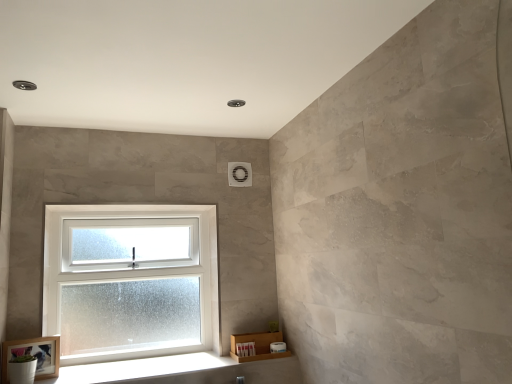
Question: From the image's perspective, is wooden frame at lower left on top of white wood at lower left?

Choices:
 (A) no
 (B) yes

Answer: (B)

Question: From the image's perspective, is wooden frame at lower left below white wood at lower left?

Choices:
 (A) yes
 (B) no

Answer: (B)

Question: Is wooden frame at lower left positioned with its back to white wood at lower left?

Choices:
 (A) yes
 (B) no

Answer: (B)

Question: Would you consider wooden frame at lower left to be distant from white wood at lower left?

Choices:
 (A) no
 (B) yes

Answer: (A)

Question: Is wooden frame at lower left to the right of white wood at lower left from the viewer's perspective?

Choices:
 (A) yes
 (B) no

Answer: (B)

Question: Is wooden frame at lower left shorter than white wood at lower left?

Choices:
 (A) no
 (B) yes

Answer: (A)

Question: Is wooden frame at lower left far away from white frosted glass window at lower left?

Choices:
 (A) no
 (B) yes

Answer: (A)

Question: Does wooden frame at lower left appear on the left side of white frosted glass window at lower left?

Choices:
 (A) yes
 (B) no

Answer: (A)

Question: Considering the relative sizes of wooden frame at lower left and white frosted glass window at lower left in the image provided, is wooden frame at lower left bigger than white frosted glass window at lower left?

Choices:
 (A) yes
 (B) no

Answer: (B)

Question: Is wooden frame at lower left positioned with its back to white frosted glass window at lower left?

Choices:
 (A) yes
 (B) no

Answer: (B)

Question: Is wooden frame at lower left positioned in front of white frosted glass window at lower left?

Choices:
 (A) no
 (B) yes

Answer: (B)

Question: Considering the relative sizes of wooden frame at lower left and white frosted glass window at lower left in the image provided, is wooden frame at lower left taller than white frosted glass window at lower left?

Choices:
 (A) yes
 (B) no

Answer: (B)

Question: Considering the relative positions of white frosted glass window at lower left and white wood at lower left in the image provided, is white frosted glass window at lower left to the left of white wood at lower left from the viewer's perspective?

Choices:
 (A) no
 (B) yes

Answer: (B)